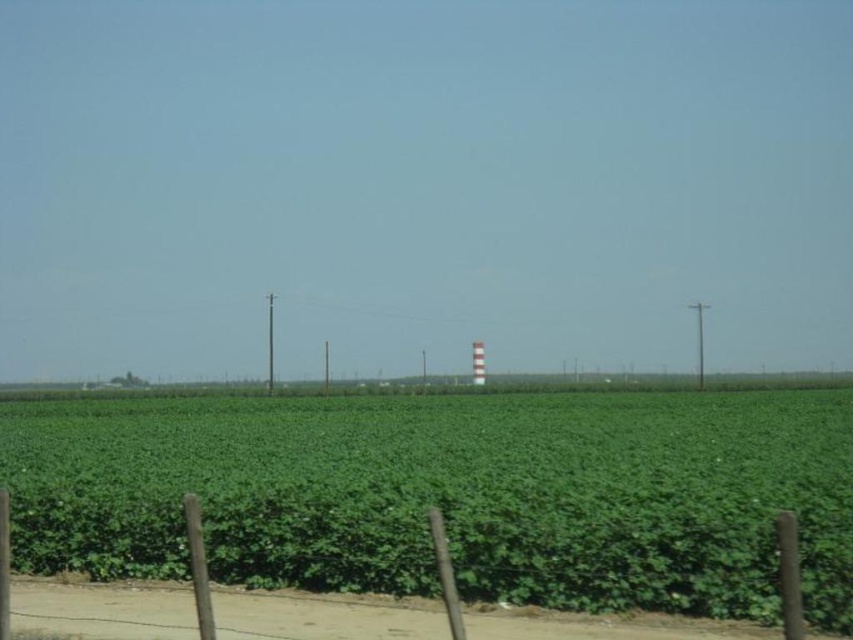
Question: Among these objects, which one is nearest to the camera?

Choices:
 (A) green leafy field at center
 (B) smooth wood pole at center

Answer: (A)

Question: Where is green leafy field at center located in relation to smooth wood pole at center in the image?

Choices:
 (A) above
 (B) below

Answer: (B)

Question: Can you confirm if green leafy field at center is positioned to the left of smooth wood pole at center?

Choices:
 (A) yes
 (B) no

Answer: (B)

Question: Which object is closer to the camera taking this photo?

Choices:
 (A) smooth wood pole at center
 (B) green leafy field at center

Answer: (B)

Question: Is green leafy field at center above smooth wood pole at center?

Choices:
 (A) no
 (B) yes

Answer: (A)

Question: Which of the following is the farthest from the observer?

Choices:
 (A) green leafy field at center
 (B) smooth wood pole at center

Answer: (B)